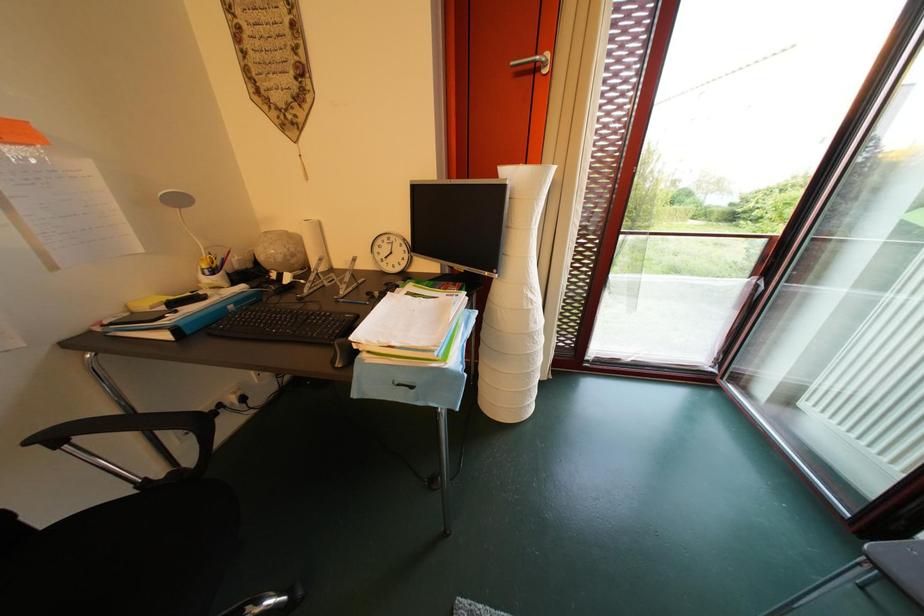
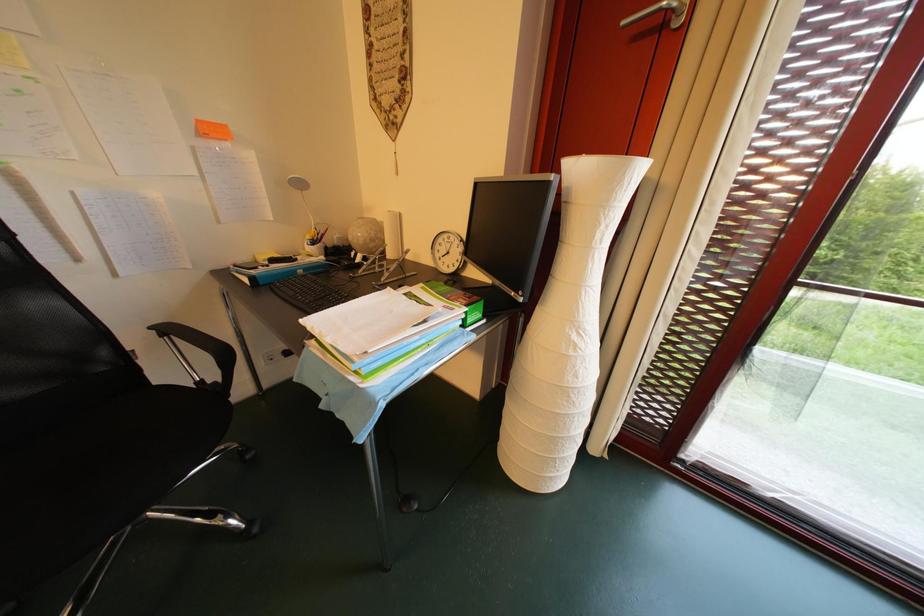
Question: The camera is either moving clockwise (left) or counter-clockwise (right) around the object. The first image is from the beginning of the video and the second image is from the end. Is the camera moving left or right when shooting the video?

Choices:
 (A) Left
 (B) Right

Answer: (B)